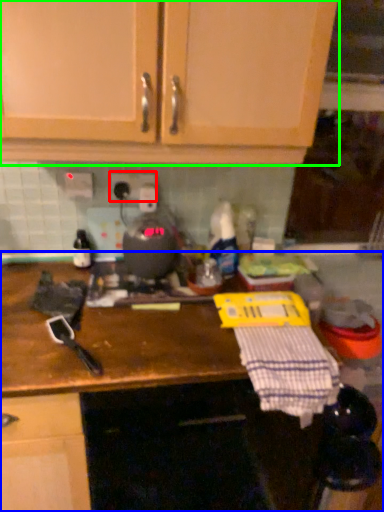
Question: Which object is positioned farthest from electric outlet (highlighted by a red box)? Select from countertop (highlighted by a blue box) and cabinetry (highlighted by a green box).

Choices:
 (A) countertop
 (B) cabinetry

Answer: (A)